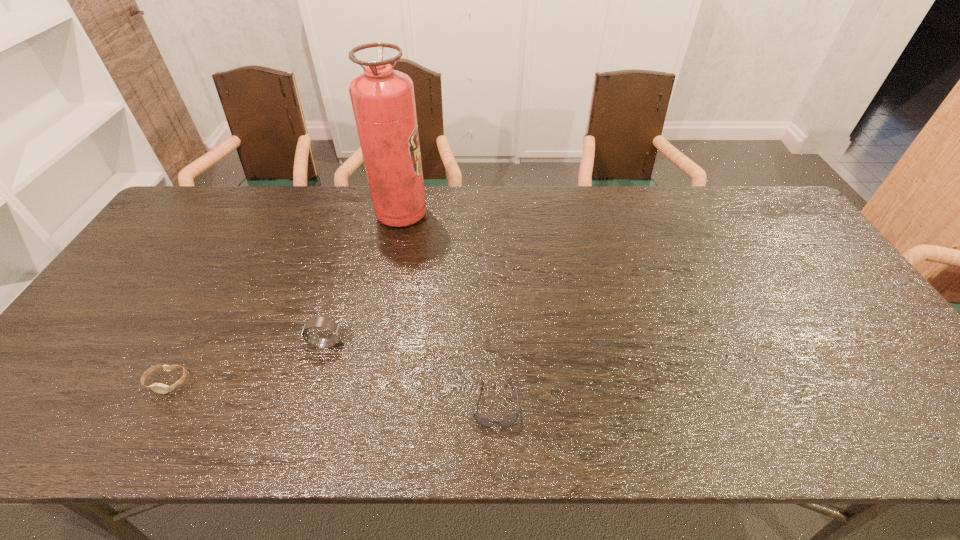
Where is `free space between the right watch and the fire extinguisher`? This screenshot has height=540, width=960. free space between the right watch and the fire extinguisher is located at coordinates pos(364,279).

Image resolution: width=960 pixels, height=540 pixels. Find the location of `free area in between the sunglasses and the farthest object`. free area in between the sunglasses and the farthest object is located at coordinates (448, 309).

Locate an element on the screen. vacant point located between the taller watch and the rightmost object is located at coordinates (411, 374).

This screenshot has height=540, width=960. What are the coordinates of `vacant area that lies between the rightmost object and the farther watch` in the screenshot? It's located at (411, 374).

I want to click on free spot between the farthest object and the shorter watch, so click(284, 298).

You are a GUI agent. You are given a task and a screenshot of the screen. Output one action in this format:
    pyautogui.click(x=<x>, y=<y>)
    Task: Click on the free point between the tallest object and the leftmost object
    
    Given the screenshot: What is the action you would take?
    pyautogui.click(x=284, y=298)

Choose which object is the third nearest neighbor to the farthest object. Please provide its 2D coordinates. Your answer should be formatted as a tuple, i.e. [(x, y)], where the tuple contains the x and y coordinates of a point satisfying the conditions above.

[(156, 387)]

Point out which object is positioned as the third nearest to the taller watch. Please provide its 2D coordinates. Your answer should be formatted as a tuple, i.e. [(x, y)], where the tuple contains the x and y coordinates of a point satisfying the conditions above.

[(383, 102)]

Locate an element on the screen. Image resolution: width=960 pixels, height=540 pixels. vacant space that satisfies the following two spatial constraints: 1. on the label side of the fire extinguisher; 2. on the face of the leftmost object is located at coordinates (369, 382).

I want to click on free space that satisfies the following two spatial constraints: 1. on the label side of the fire extinguisher; 2. on the face of the nearer watch, so click(369, 382).